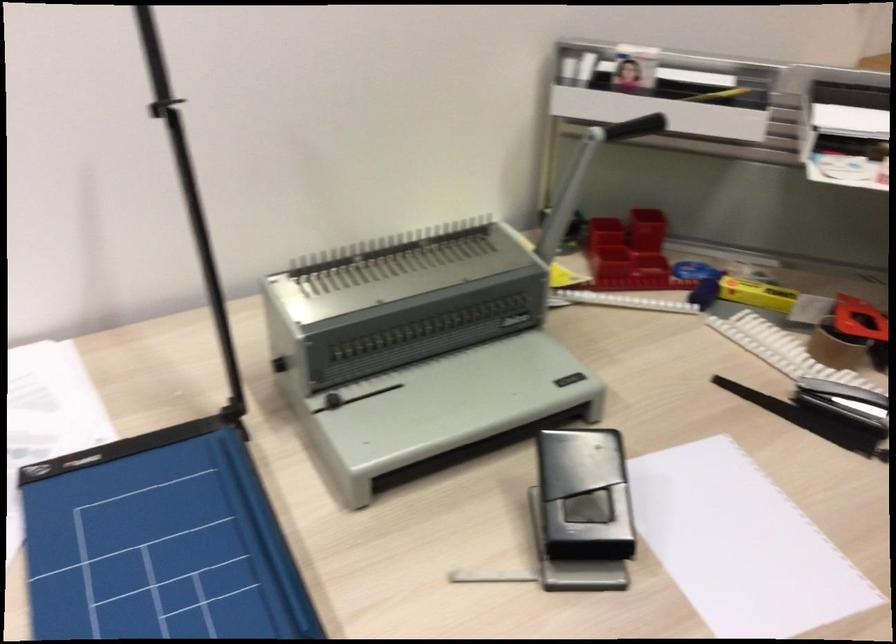
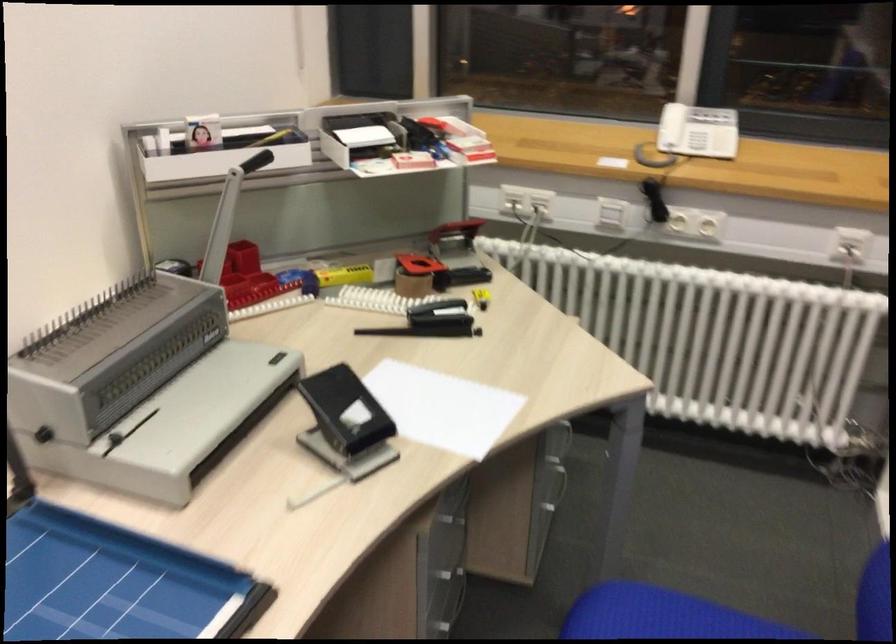
Where in the second image is the point corresponding to point 824,323 from the first image?

(414, 272)